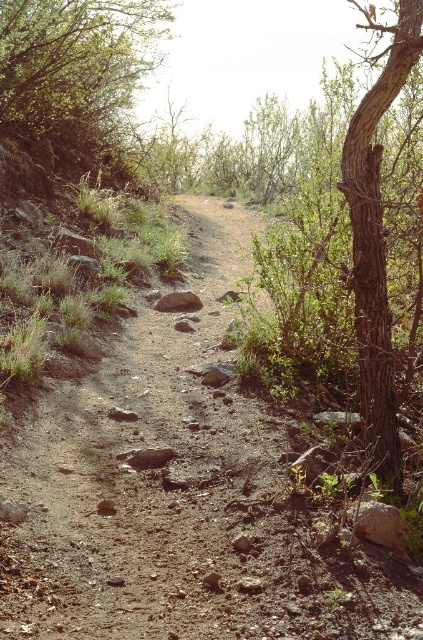
Looking at this image, between green leafy tree at upper left and brown rough bark tree at right, which one has more height?

With more height is brown rough bark tree at right.

Who is lower down, green leafy tree at upper left or brown rough bark tree at right?

green leafy tree at upper left is below.

Locate an element on the screen. This screenshot has width=423, height=640. green leafy tree at upper left is located at coordinates (76, 58).

Find the location of a particular element. green leafy tree at upper left is located at coordinates (76, 58).

Which is behind, point (354, 564) or point (32, 20)?

Positioned behind is point (32, 20).

Is point (275, 534) behind point (107, 74)?

No.

In order to click on dusty brown dirt track at center in this screenshot , I will do `click(180, 493)`.

Locate an element on the screen. Image resolution: width=423 pixels, height=640 pixels. dusty brown dirt track at center is located at coordinates (180, 493).

Between brown rough bark tree at right and brown rough rock at center, which one appears on the left side from the viewer's perspective?

brown rough rock at center

The image size is (423, 640). What do you see at coordinates (376, 244) in the screenshot?
I see `brown rough bark tree at right` at bounding box center [376, 244].

Locate an element on the screen. This screenshot has width=423, height=640. brown rough bark tree at right is located at coordinates (376, 244).